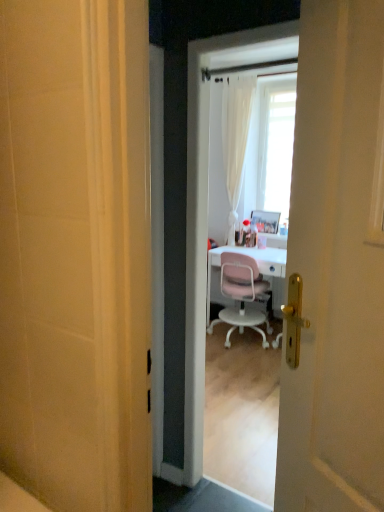
Question: In the image, is metallic silver picture frame at center on the left side or the right side of pink plastic chair at center?

Choices:
 (A) right
 (B) left

Answer: (A)

Question: Considering their positions, is metallic silver picture frame at center located in front of or behind pink plastic chair at center?

Choices:
 (A) behind
 (B) front

Answer: (A)

Question: From a real-world perspective, relative to pink plastic chair at center, is metallic silver picture frame at center vertically above or below?

Choices:
 (A) above
 (B) below

Answer: (A)

Question: From the image's perspective, is pink plastic chair at center located above or below metallic silver picture frame at center?

Choices:
 (A) below
 (B) above

Answer: (A)

Question: From a real-world perspective, is pink plastic chair at center physically located above or below metallic silver picture frame at center?

Choices:
 (A) above
 (B) below

Answer: (B)

Question: In the image, is pink plastic chair at center positioned in front of or behind metallic silver picture frame at center?

Choices:
 (A) front
 (B) behind

Answer: (A)

Question: Looking at their shapes, would you say pink plastic chair at center is wider or thinner than metallic silver picture frame at center?

Choices:
 (A) wide
 (B) thin

Answer: (A)